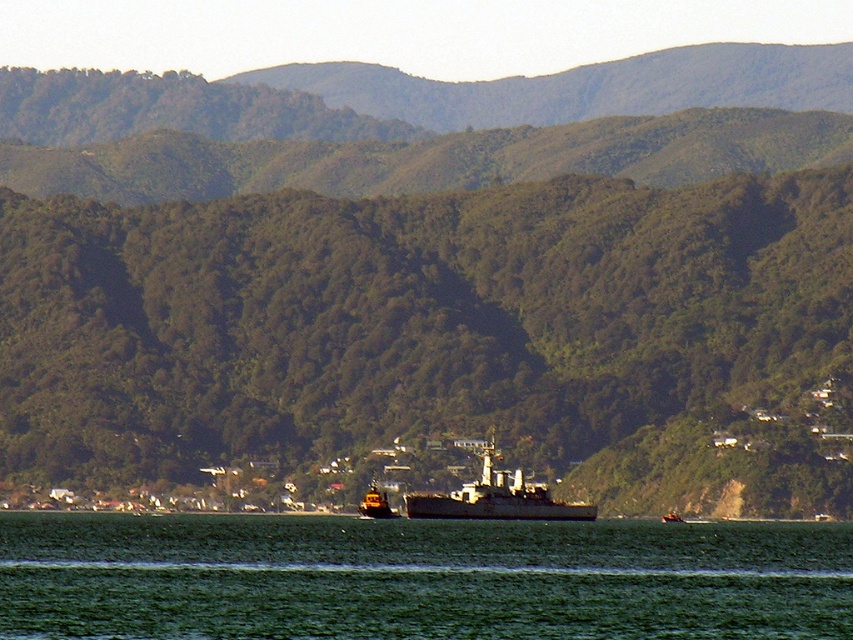
You are a sailor who needs to navigate a small boat through the bay. The green water at lower center and the yellow rubber boat at center are in your path. Which one should you avoid to stay within the navigable area?

The green water at lower center is larger in size than the yellow rubber boat at center, so you should avoid the yellow rubber boat at center to stay within the navigable area since it is smaller and likely occupies less space.

You are standing on the shore of the bay and see the gray metallic ship at center. If you were to draw a straight line from your position to the ship, what would be the coordinates of the point where the line intersects the ship?

The coordinates of the point where the line intersects the gray metallic ship at center are at point (x=496, y=497).

You are standing on the shore looking at the scene. There is a point marked at coordinates (x=418, y=579). What is located at that point?

The point at coordinates (x=418, y=579) indicates green water at lower center.